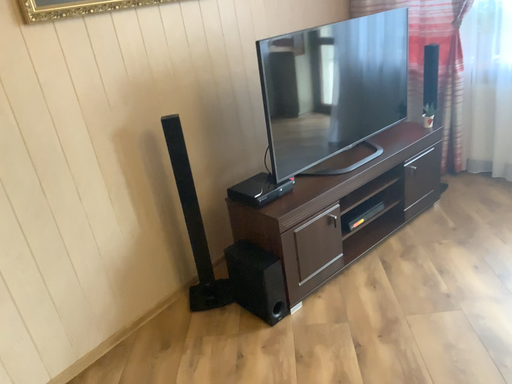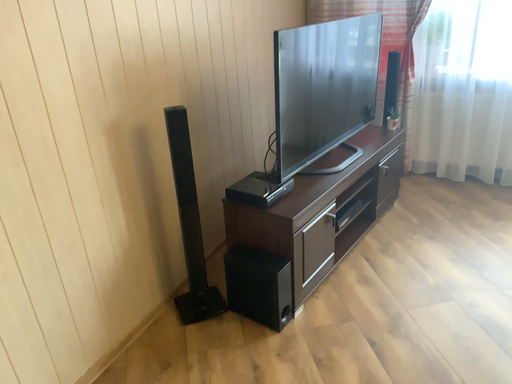
Question: Which way did the camera rotate in the video?

Choices:
 (A) rotated right
 (B) rotated left

Answer: (A)